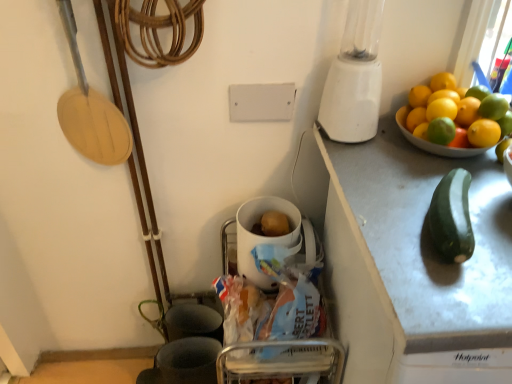
Locate an element on the screen. Image resolution: width=512 pixels, height=384 pixels. unoccupied area in front of yellow matte lemon at upper right, the 3th lemon ordered from the bottom is located at coordinates (436, 188).